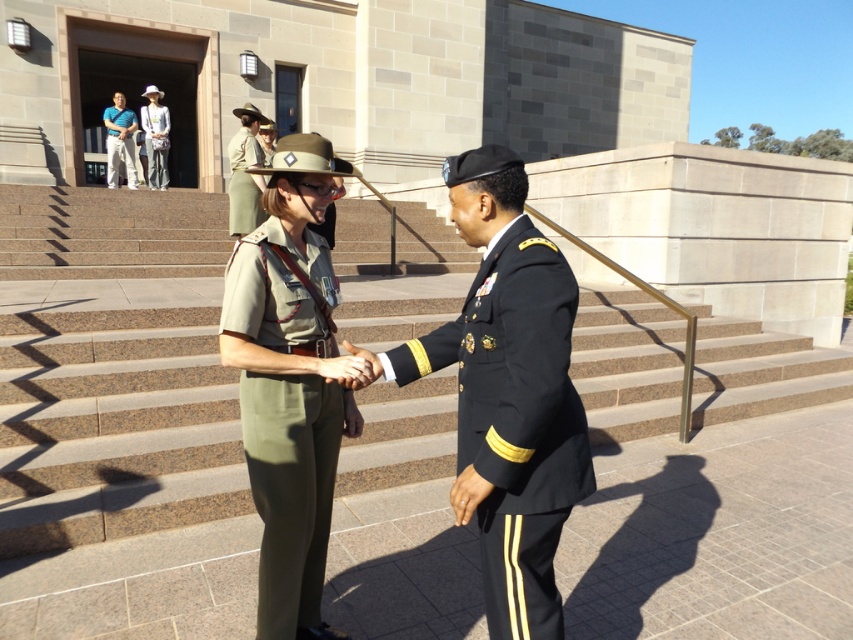
Question: Which point is farther to the camera?

Choices:
 (A) green fabric uniform at center
 (B) khaki fabric uniform at center
 (C) shiny black uniform at center

Answer: (B)

Question: Which object is positioned closest to the light blue cotton shirt at upper center?

Choices:
 (A) shiny black uniform at center
 (B) brown stone stairs at center
 (C) blue cotton shirt at upper left
 (D) green fabric uniform at center

Answer: (C)

Question: Which of these objects is positioned closest to the shiny black uniform at center?

Choices:
 (A) green fabric uniform at center
 (B) blue cotton shirt at upper left
 (C) light blue cotton shirt at upper center
 (D) brown stone stairs at center

Answer: (A)

Question: Is shiny black uniform at center in front of light blue cotton shirt at upper center?

Choices:
 (A) no
 (B) yes

Answer: (B)

Question: Is shiny black uniform at center above light blue cotton shirt at upper center?

Choices:
 (A) no
 (B) yes

Answer: (A)

Question: Is brown stone stairs at center to the left of blue cotton shirt at upper left from the viewer's perspective?

Choices:
 (A) yes
 (B) no

Answer: (B)